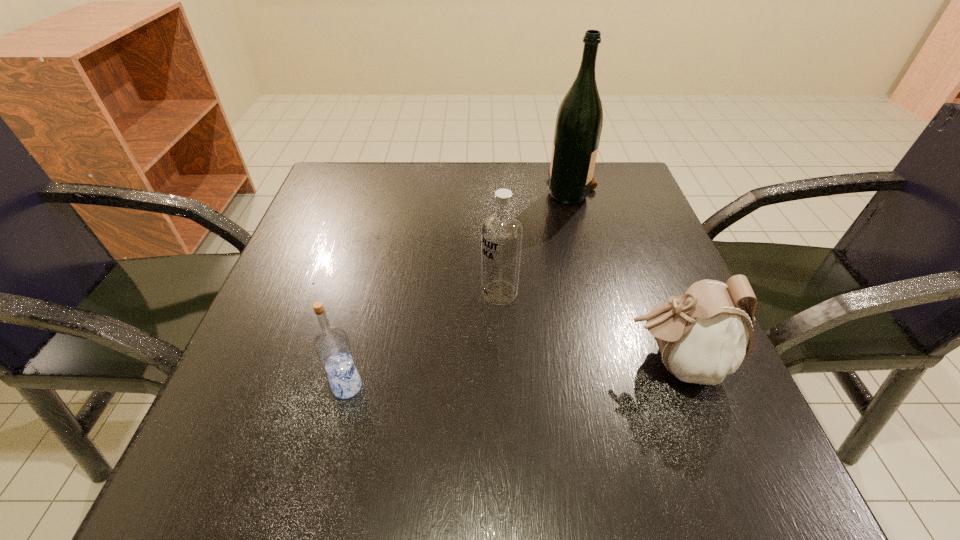
Identify the location of wine bottle. This screenshot has width=960, height=540. (579, 121).

The height and width of the screenshot is (540, 960). I want to click on the tallest object, so click(579, 121).

Where is `the second tallest object`? the second tallest object is located at coordinates (502, 232).

Locate an element on the screen. the third nearest object is located at coordinates (502, 232).

I want to click on the left vodka, so click(x=331, y=344).

You are a GUI agent. You are given a task and a screenshot of the screen. Output one action in this format:
    pyautogui.click(x=<x>, y=<y>)
    Task: Click on the nearer vodka
    This screenshot has width=960, height=540.
    Given the screenshot: What is the action you would take?
    pyautogui.click(x=331, y=344)

Locate an element on the screen. pouch is located at coordinates (707, 333).

Identify the location of free space located on the front of the farthest object. (588, 247).

At what (x,y) coordinates should I click in order to perform the action: click on free space located 0.090m on the front label of the taller vodka. Please return your answer as a coordinate pair (x, y). Image resolution: width=960 pixels, height=540 pixels. Looking at the image, I should click on (431, 293).

Find the location of `free location located on the front label of the taller vodka`. free location located on the front label of the taller vodka is located at coordinates (365, 293).